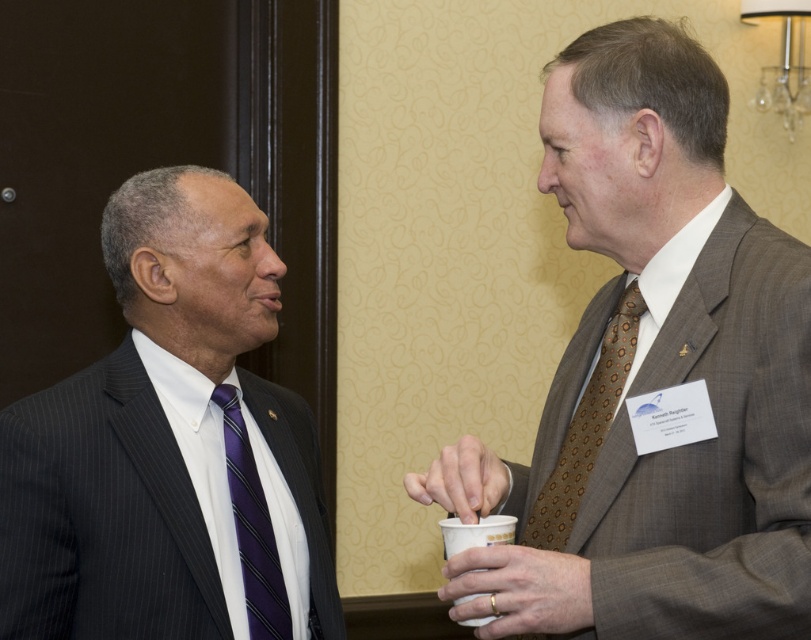
In the scene shown: Is gold metallic ring at lower right shorter than white paper cup at lower center?

Indeed, gold metallic ring at lower right has a lesser height compared to white paper cup at lower center.

Who is shorter, gold metallic ring at lower right or white paper cup at lower center?

Standing shorter between the two is gold metallic ring at lower right.

Does point (515, 548) come in front of point (453, 541)?

Yes.

Where is `gold metallic ring at lower right`? This screenshot has height=640, width=811. gold metallic ring at lower right is located at coordinates (518, 589).

Is matte black suit at left behind white paper cup at lower center?

Yes, matte black suit at left is further from the viewer.

Can you confirm if matte black suit at left is positioned to the right of white paper cup at lower center?

Incorrect, matte black suit at left is not on the right side of white paper cup at lower center.

What are the coordinates of `matte black suit at left` in the screenshot? It's located at (169, 445).

Is matte black suit at left bigger than purple striped tie at left?

Indeed, matte black suit at left has a larger size compared to purple striped tie at left.

Which is behind, point (176, 616) or point (260, 577)?

Positioned behind is point (260, 577).

Image resolution: width=811 pixels, height=640 pixels. What are the coordinates of `matte black suit at left` in the screenshot? It's located at (169, 445).